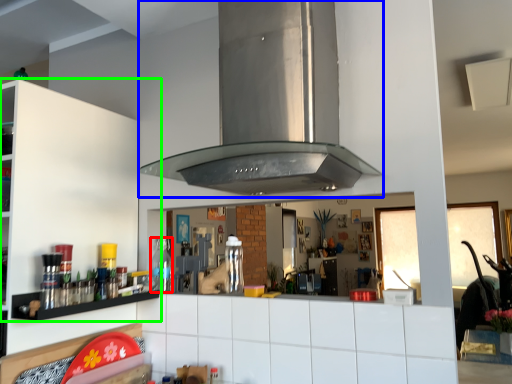
Question: Estimate the real-world distances between objects in this image. Which object is closer to bottle (highlighted by a red box), vent (highlighted by a blue box) or cabinetry (highlighted by a green box)?

Choices:
 (A) vent
 (B) cabinetry

Answer: (B)